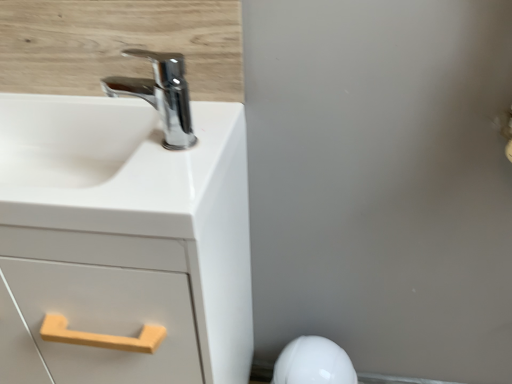
Question: Can you confirm if white matte cabinet at left is positioned to the right of chrome/metallic faucet at upper left?

Choices:
 (A) no
 (B) yes

Answer: (A)

Question: Is white matte cabinet at left closer to camera compared to chrome/metallic faucet at upper left?

Choices:
 (A) no
 (B) yes

Answer: (B)

Question: Is white matte cabinet at left surrounding chrome/metallic faucet at upper left?

Choices:
 (A) no
 (B) yes

Answer: (A)

Question: Are white matte cabinet at left and chrome/metallic faucet at upper left beside each other?

Choices:
 (A) no
 (B) yes

Answer: (A)

Question: Is the position of white matte cabinet at left more distant than that of chrome/metallic faucet at upper left?

Choices:
 (A) no
 (B) yes

Answer: (A)

Question: Does point (181, 77) appear closer or farther from the camera than point (336, 360)?

Choices:
 (A) farther
 (B) closer

Answer: (B)

Question: Considering their positions, is chrome/metallic faucet at upper left located in front of or behind white glossy porcelain at lower right?

Choices:
 (A) behind
 (B) front

Answer: (B)

Question: In terms of width, does chrome/metallic faucet at upper left look wider or thinner when compared to white glossy porcelain at lower right?

Choices:
 (A) thin
 (B) wide

Answer: (A)

Question: Is chrome/metallic faucet at upper left taller or shorter than white glossy porcelain at lower right?

Choices:
 (A) short
 (B) tall

Answer: (A)

Question: Choose the correct answer: Is white matte cabinet at left inside chrome/metallic faucet at upper left or outside it?

Choices:
 (A) outside
 (B) inside

Answer: (A)

Question: Considering the positions of white matte cabinet at left and chrome/metallic faucet at upper left in the image, is white matte cabinet at left wider or thinner than chrome/metallic faucet at upper left?

Choices:
 (A) wide
 (B) thin

Answer: (A)

Question: From a real-world perspective, relative to chrome/metallic faucet at upper left, is white matte cabinet at left vertically above or below?

Choices:
 (A) above
 (B) below

Answer: (B)

Question: From the image's perspective, relative to chrome/metallic faucet at upper left, is white matte cabinet at left above or below?

Choices:
 (A) above
 (B) below

Answer: (B)

Question: Is chrome/metallic faucet at upper left to the left or to the right of white matte cabinet at left in the image?

Choices:
 (A) right
 (B) left

Answer: (A)

Question: From the image's perspective, is chrome/metallic faucet at upper left located above or below white matte cabinet at left?

Choices:
 (A) above
 (B) below

Answer: (A)